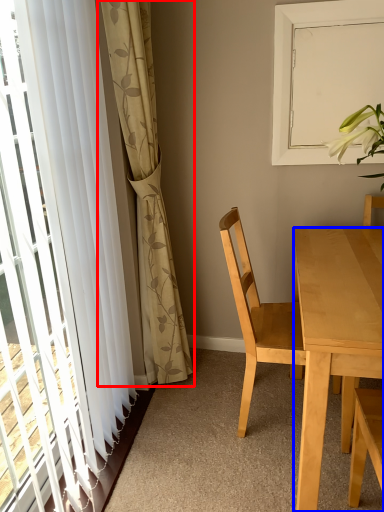
Question: Which object appears closest to the camera in this image, curtain (highlighted by a red box) or desk (highlighted by a blue box)?

Choices:
 (A) curtain
 (B) desk

Answer: (B)